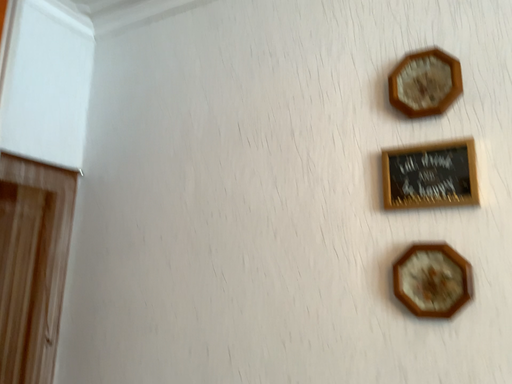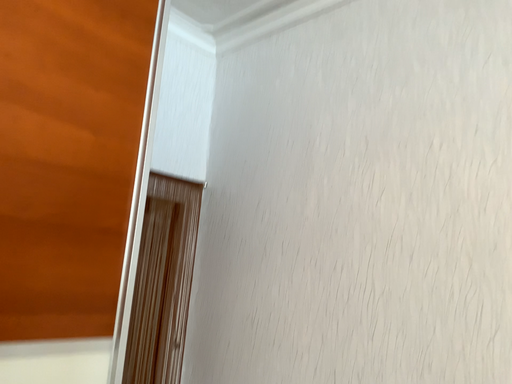
Question: How did the camera likely rotate when shooting the video?

Choices:
 (A) rotated left
 (B) rotated right

Answer: (A)